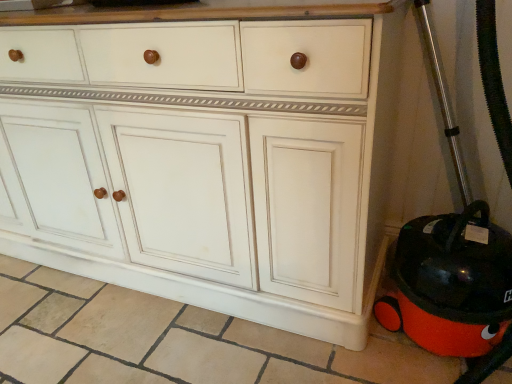
Identify the location of white painted wood cabinet at center. Image resolution: width=512 pixels, height=384 pixels. pos(208,160).

What do you see at coordinates (208, 160) in the screenshot?
I see `white painted wood cabinet at center` at bounding box center [208, 160].

I want to click on white painted wood cabinet at center, so click(x=208, y=160).